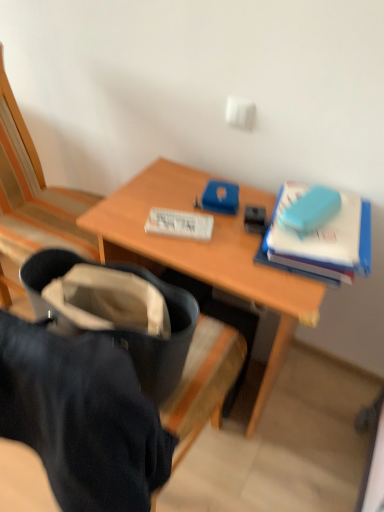
At what (x,y) coordinates should I click in order to perform the action: click on free location to the left of blue matte book at upper right, the 1th paperback book in the right-to-left sequence. Please return your answer as a coordinate pair (x, y). Looking at the image, I should click on (218, 229).